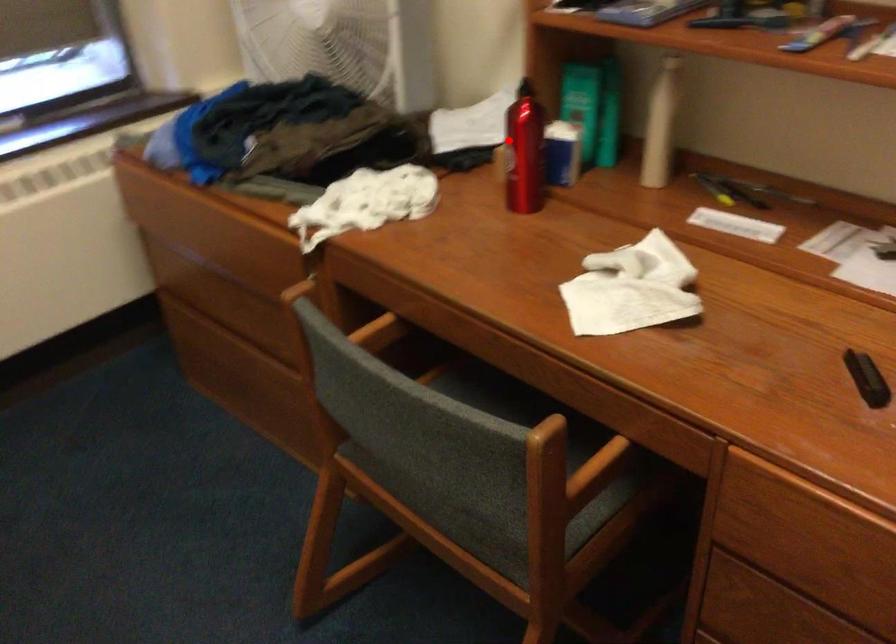
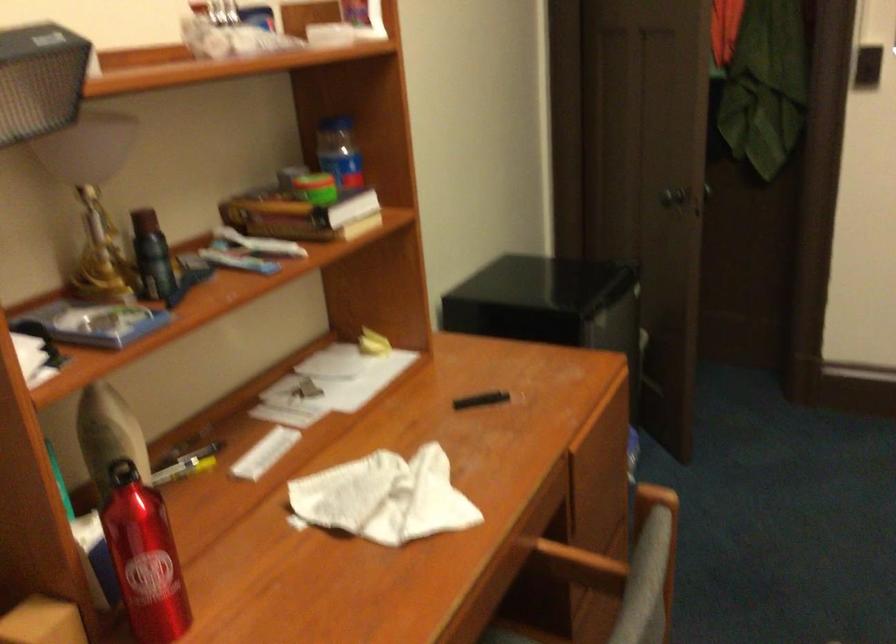
Question: I am providing you with two images of the same scene from different viewpoints. In image1, a red point is highlighted. Considering the same 3D point in image2, which of the following is correct?

Choices:
 (A) It is closer
 (B) It is farther

Answer: (A)